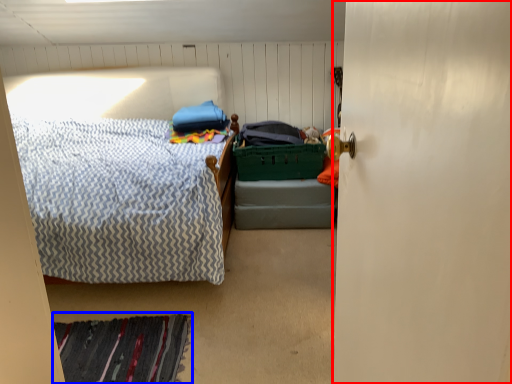
Question: Which of the following is the closest to the observer, door (highlighted by a red box) or mat (highlighted by a blue box)?

Choices:
 (A) door
 (B) mat

Answer: (A)